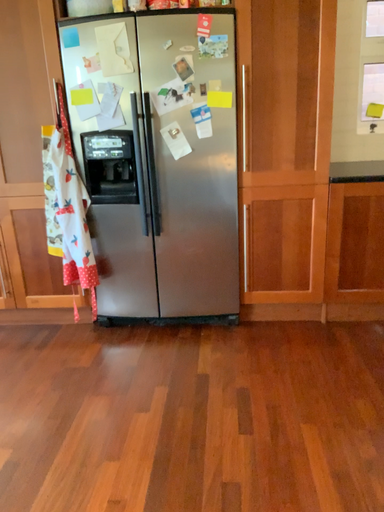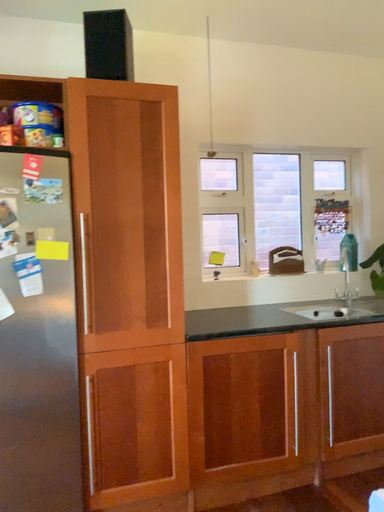
Question: Which way did the camera rotate in the video?

Choices:
 (A) rotated right
 (B) rotated left

Answer: (A)